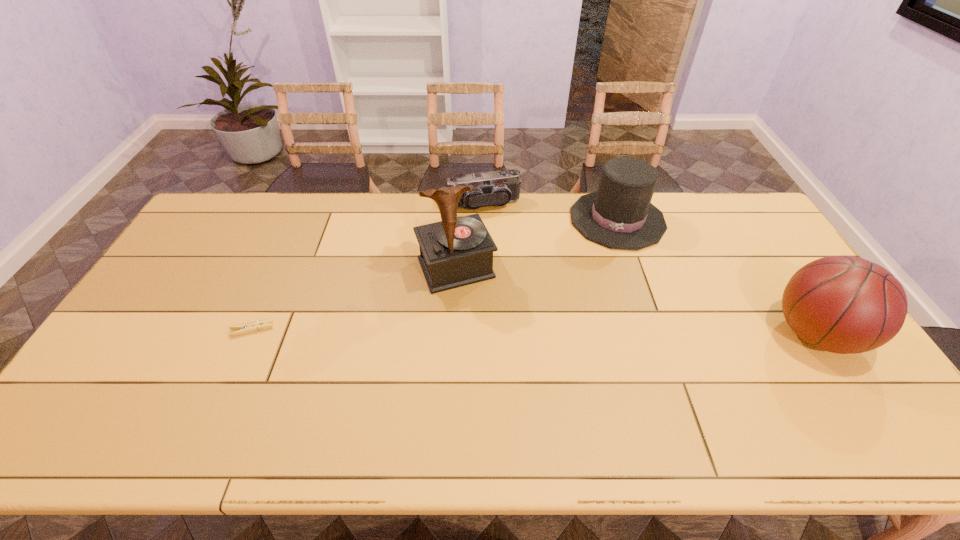
Find the location of a particular element. the leftmost object is located at coordinates (250, 327).

This screenshot has height=540, width=960. In order to click on clothespin in this screenshot , I will do `click(250, 327)`.

At what (x,y) coordinates should I click in order to perform the action: click on basketball. Please return your answer as a coordinate pair (x, y). Looking at the image, I should click on (843, 304).

At what (x,y) coordinates should I click in order to perform the action: click on the rightmost object. Please return your answer as a coordinate pair (x, y). The width and height of the screenshot is (960, 540). Looking at the image, I should click on (843, 304).

Where is `the third tallest object`? This screenshot has width=960, height=540. the third tallest object is located at coordinates [x=619, y=215].

Locate an element on the screen. This screenshot has height=540, width=960. the second object from right to left is located at coordinates (619, 215).

This screenshot has height=540, width=960. Identify the location of camcorder. (498, 188).

The width and height of the screenshot is (960, 540). I want to click on phonograph_record, so click(457, 251).

Find the location of a particular element. The image size is (960, 540). vacant space located 0.130m on the front of the shortest object is located at coordinates (229, 380).

Locate an element on the screen. This screenshot has height=540, width=960. vacant space situated 0.050m on the left of the basketball is located at coordinates (752, 334).